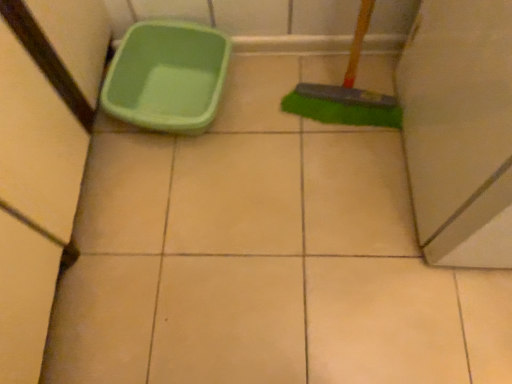
At what (x,y) coordinates should I click in order to perform the action: click on free space in front of green plastic tray at upper left. Please return your answer as a coordinate pair (x, y). This screenshot has width=512, height=384. Looking at the image, I should click on (182, 196).